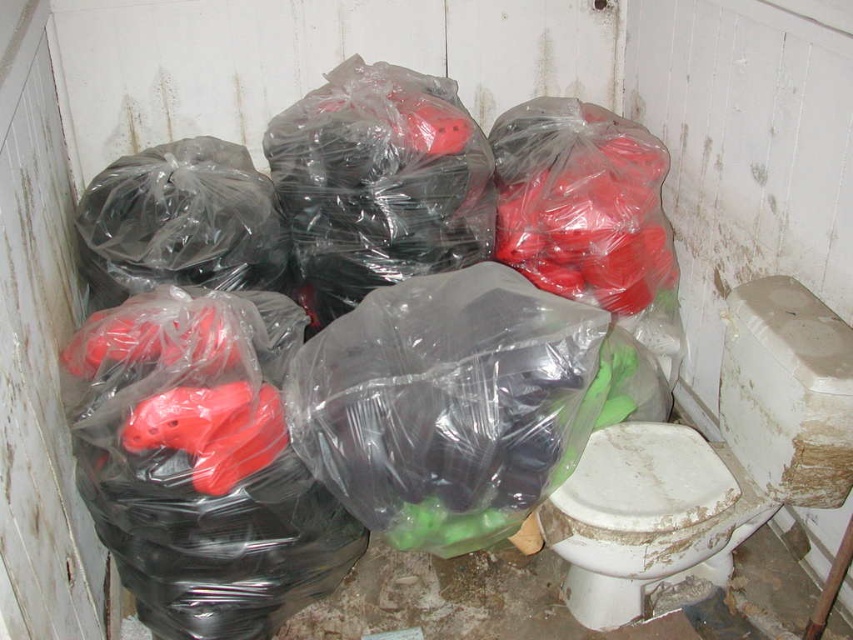
Who is positioned more to the right, translucent plastic bags at center or white glossy toilet bowl at lower right?

white glossy toilet bowl at lower right is more to the right.

Which is behind, point (384, 330) or point (845, 394)?

The point (384, 330) is behind.

Where is `translucent plastic bags at center`? The width and height of the screenshot is (853, 640). translucent plastic bags at center is located at coordinates (347, 417).